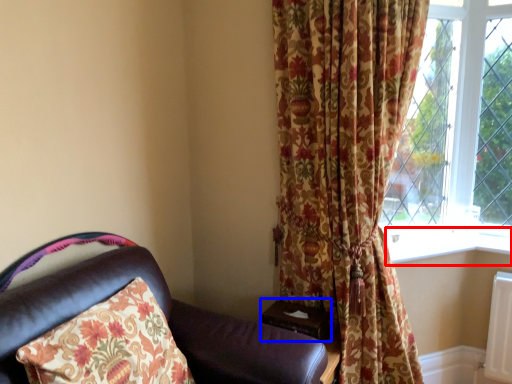
Question: Which point is further to the camera, window sill (highlighted by a red box) or table (highlighted by a blue box)?

Choices:
 (A) window sill
 (B) table

Answer: (A)